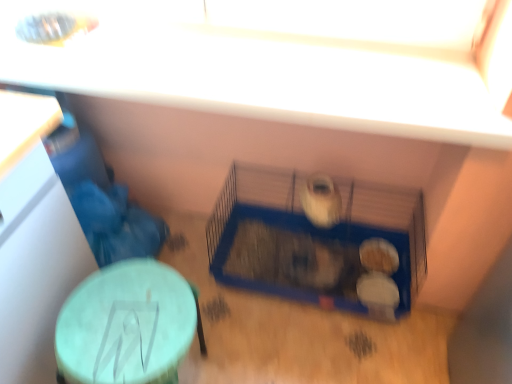
At what (x,y) coordinates should I click in order to perform the action: click on free space to the left of blue plastic cage at center. Please return your answer as a coordinate pair (x, y). This screenshot has width=512, height=384. Looking at the image, I should click on (210, 287).